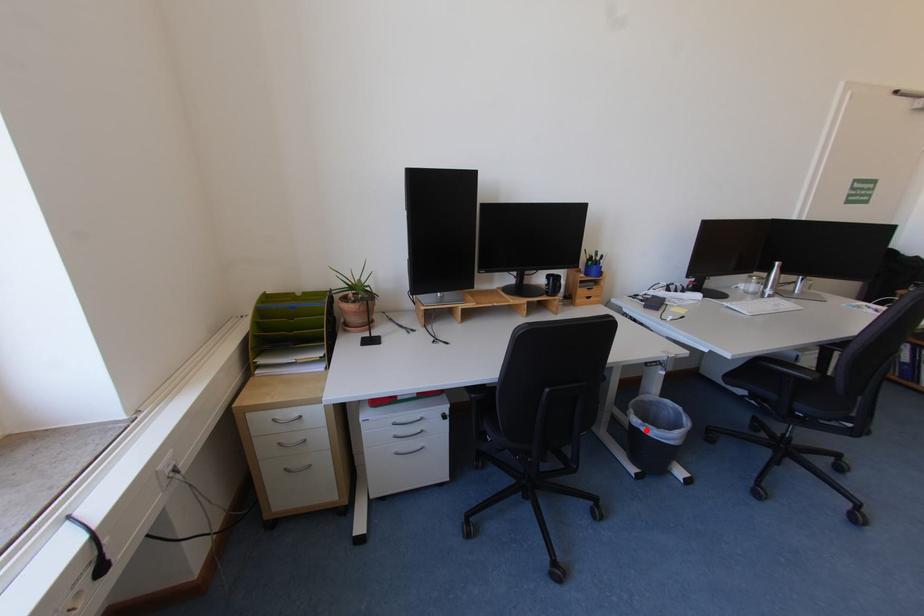
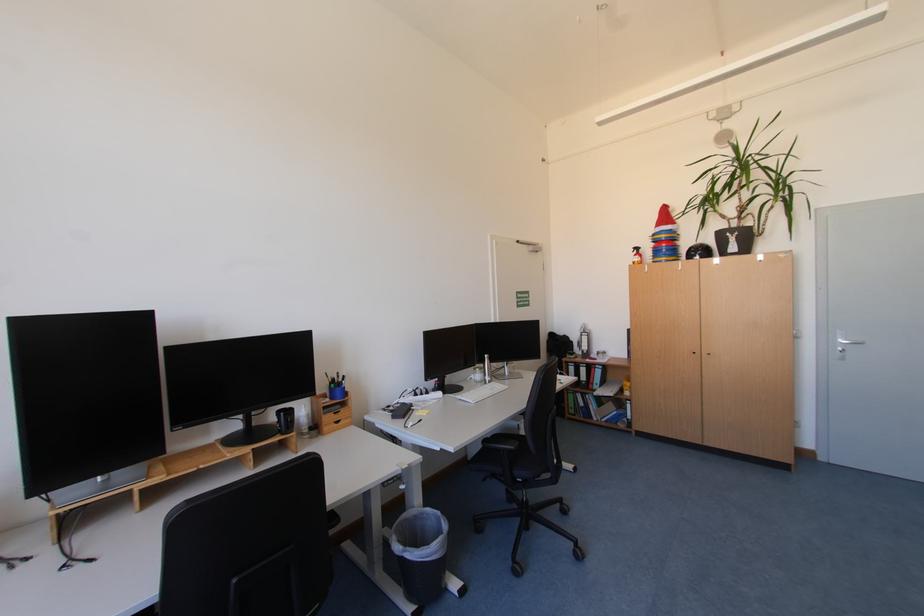
Find the pixel in the second image that matches the highlighted location in the first image.

(409, 557)